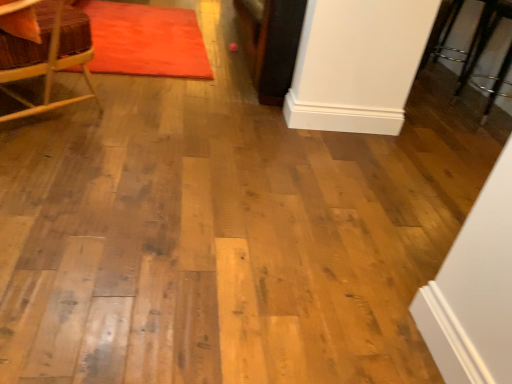
Question: Would you say wooden chair at left is to the left or to the right of velvet orange mat at upper left in the picture?

Choices:
 (A) left
 (B) right

Answer: (A)

Question: Considering the positions of wooden chair at left and velvet orange mat at upper left in the image, is wooden chair at left wider or thinner than velvet orange mat at upper left?

Choices:
 (A) wide
 (B) thin

Answer: (B)

Question: Do you think wooden chair at left is within velvet orange mat at upper left, or outside of it?

Choices:
 (A) outside
 (B) inside

Answer: (A)

Question: Considering the positions of velvet orange mat at upper left and wooden chair at left in the image, is velvet orange mat at upper left taller or shorter than wooden chair at left?

Choices:
 (A) short
 (B) tall

Answer: (A)

Question: From a real-world perspective, is velvet orange mat at upper left physically located above or below wooden chair at left?

Choices:
 (A) above
 (B) below

Answer: (B)

Question: Considering the relative positions of velvet orange mat at upper left and wooden chair at left in the image provided, is velvet orange mat at upper left to the left or to the right of wooden chair at left?

Choices:
 (A) left
 (B) right

Answer: (B)

Question: From the image's perspective, is velvet orange mat at upper left above or below wooden chair at left?

Choices:
 (A) above
 (B) below

Answer: (A)